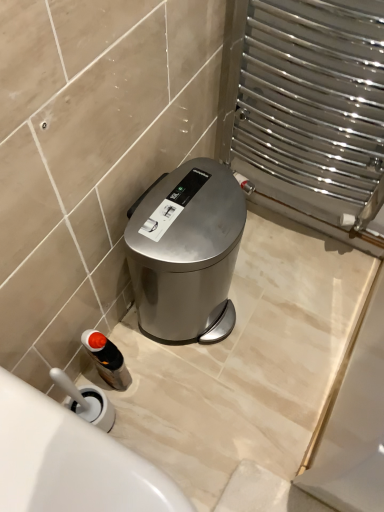
Question: In terms of width, does white glossy bath at lower left look wider or thinner when compared to translucent plastic bottle at lower left?

Choices:
 (A) thin
 (B) wide

Answer: (B)

Question: Visually, is white glossy bath at lower left positioned to the left or to the right of translucent plastic bottle at lower left?

Choices:
 (A) right
 (B) left

Answer: (A)

Question: Estimate the real-world distances between objects in this image. Which object is farther from the white glossy bath at lower left?

Choices:
 (A) translucent plastic bottle at lower left
 (B) satin silver trash can at center

Answer: (B)

Question: Estimate the real-world distances between objects in this image. Which object is closer to the translucent plastic bottle at lower left?

Choices:
 (A) satin silver trash can at center
 (B) white glossy bath at lower left

Answer: (A)